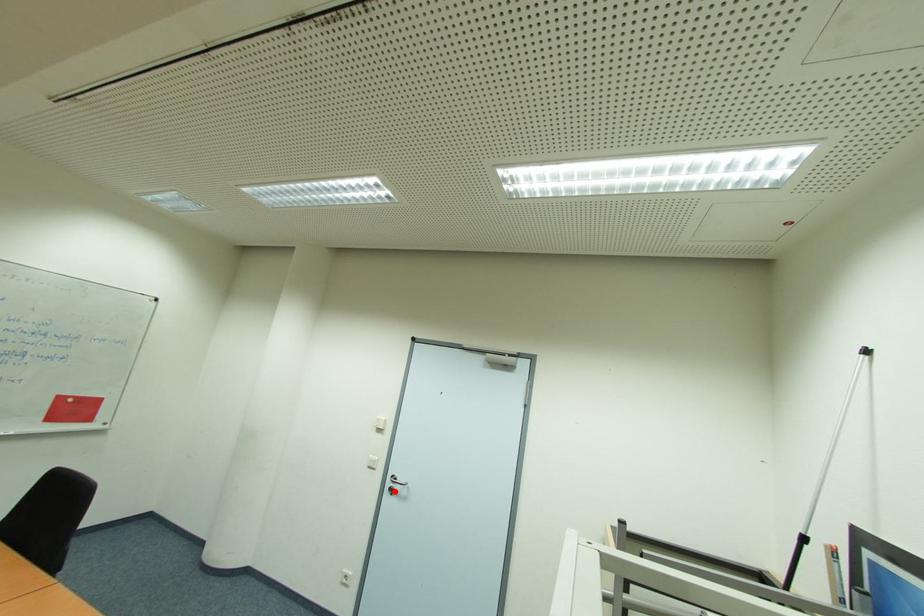
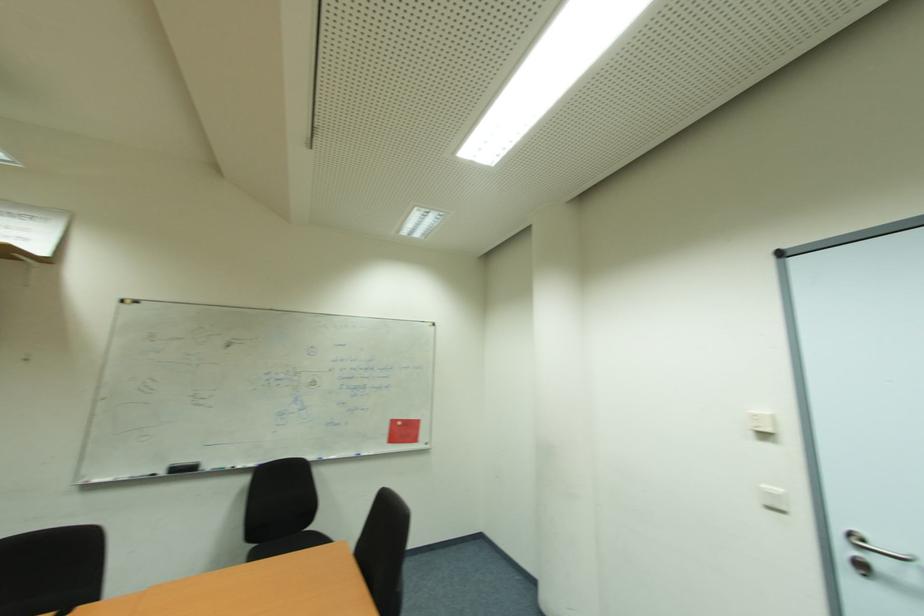
Question: I am providing you with two images of the same scene from different viewpoints. A red point is marked on the first image. Can you still see the location of the red point in image 2?

Choices:
 (A) Yes
 (B) No

Answer: (A)